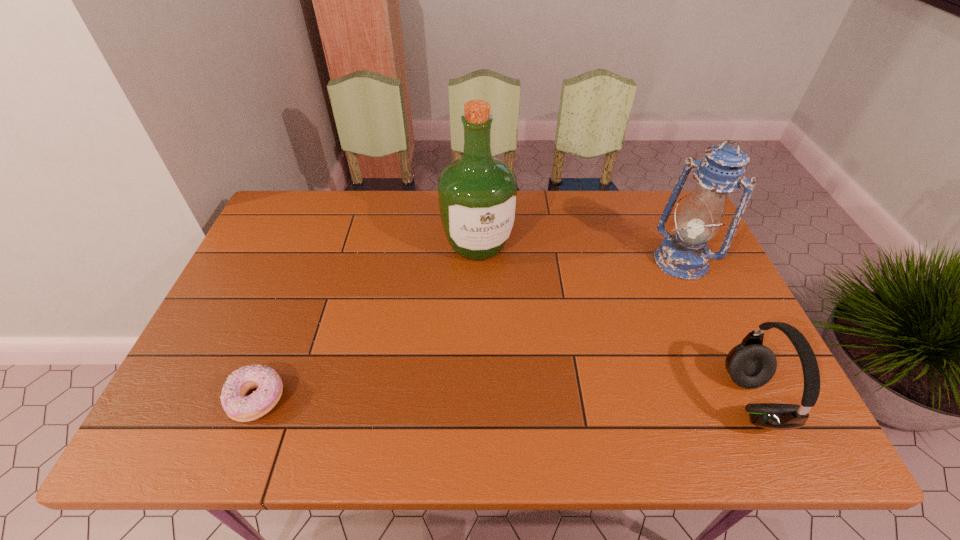
The height and width of the screenshot is (540, 960). Find the location of `object that stands as the third closest to the lantern`. object that stands as the third closest to the lantern is located at coordinates [x=239, y=407].

Locate an element on the screen. vacant space that satisfies the following two spatial constraints: 1. on the front side of the doughnut; 2. on the ear cups of the third tallest object is located at coordinates (257, 400).